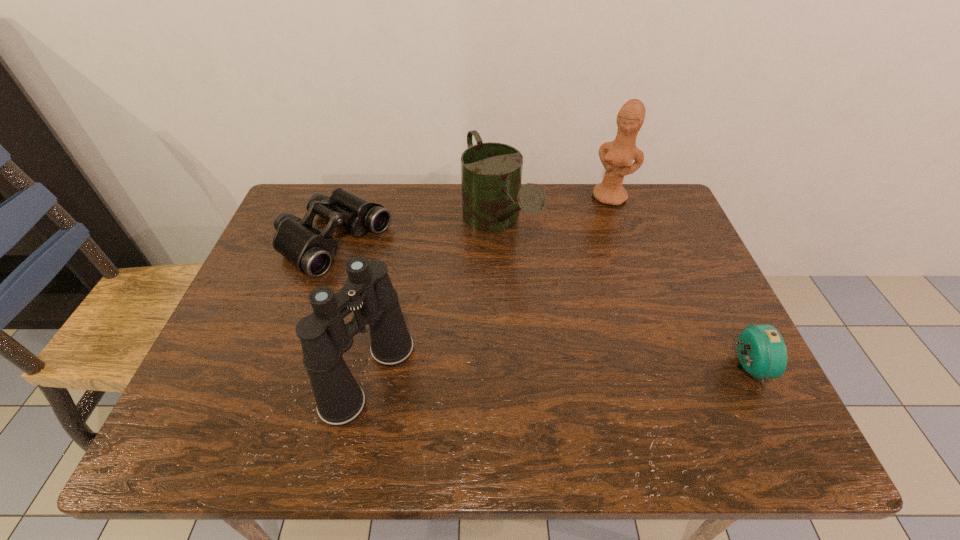
Locate an element on the screen. This screenshot has width=960, height=540. the taller binoculars is located at coordinates (368, 291).

The width and height of the screenshot is (960, 540). Find the location of `alarm clock`. alarm clock is located at coordinates (762, 353).

Locate an element on the screen. The image size is (960, 540). the third object from right to left is located at coordinates (491, 173).

What are the coordinates of `the third shortest object` in the screenshot? It's located at (491, 173).

Image resolution: width=960 pixels, height=540 pixels. What are the coordinates of `the fourth object from left to right` in the screenshot? It's located at (617, 157).

Where is `the farther binoculars`? The height and width of the screenshot is (540, 960). the farther binoculars is located at coordinates (309, 250).

In order to click on blank space located 0.100m on the left of the taller binoculars in this screenshot , I will do `click(280, 376)`.

You are a GUI agent. You are given a task and a screenshot of the screen. Output one action in this format:
    pyautogui.click(x=<x>, y=<y>)
    Task: Click on the vacant space located with the spout on the third shortest object
    This screenshot has height=540, width=960.
    Given the screenshot: What is the action you would take?
    pyautogui.click(x=532, y=291)

Where is `vacant space positioned with the spout on the third shortest object`? vacant space positioned with the spout on the third shortest object is located at coordinates (596, 385).

The image size is (960, 540). What are the coordinates of `vacant region located 0.110m with the spout on the third shortest object` in the screenshot? It's located at (535, 296).